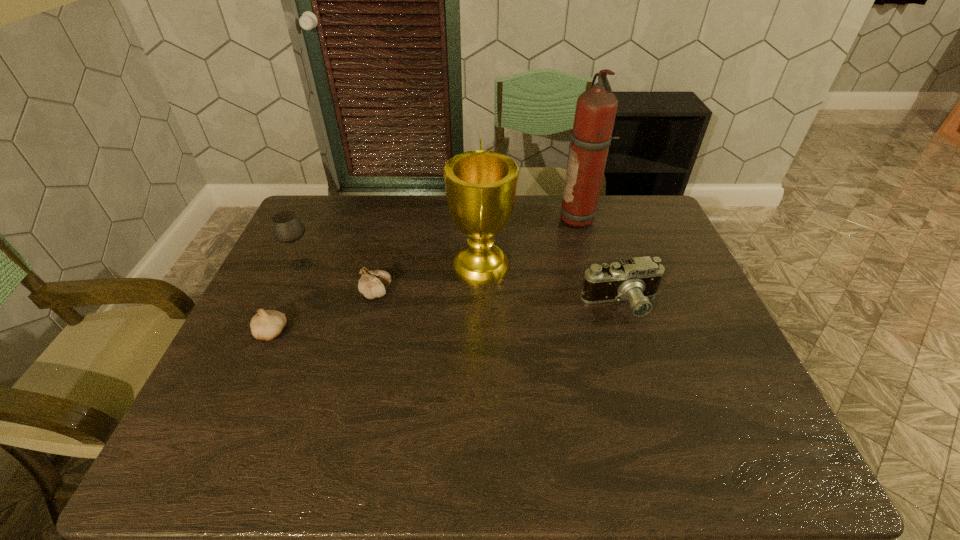
In order to click on fire extinguisher in this screenshot , I will do point(596,108).

Where is `award`? The image size is (960, 540). award is located at coordinates (480, 185).

This screenshot has height=540, width=960. I want to click on the third object from right to left, so click(x=480, y=185).

Where is `wineglass`? wineglass is located at coordinates (286, 227).

The image size is (960, 540). In order to click on camera in this screenshot , I will do `click(636, 279)`.

Where is `the farther garlic`? The width and height of the screenshot is (960, 540). the farther garlic is located at coordinates (372, 283).

Identify the location of the right garlic. This screenshot has width=960, height=540. (372, 283).

This screenshot has width=960, height=540. In order to click on the shortest object in this screenshot , I will do `click(266, 325)`.

This screenshot has width=960, height=540. Find the location of `the nearer garlic`. the nearer garlic is located at coordinates (266, 325).

Image resolution: width=960 pixels, height=540 pixels. I want to click on free space located 0.400m on the side of the tallest object with the label and nozzle, so [442, 219].